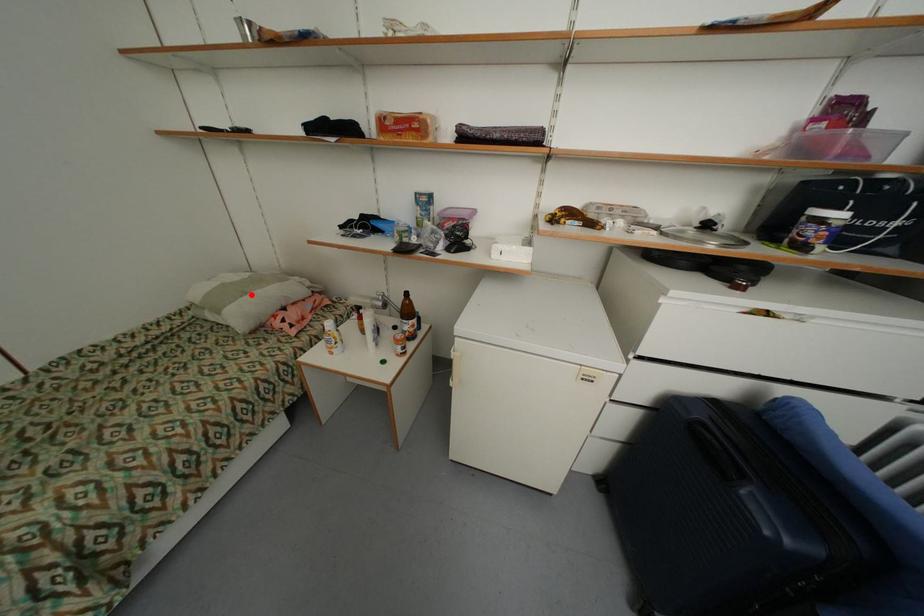
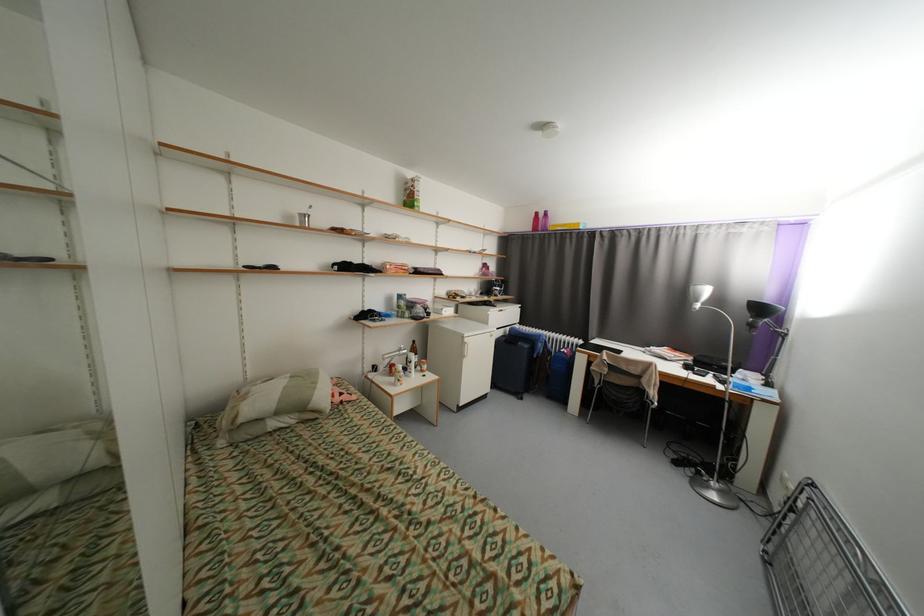
Question: A red point is marked in image1. In image2, is the corresponding 3D point closer to the camera or farther? Reply with the corresponding letter.

Choices:
 (A) The corresponding 3D point is closer.
 (B) The corresponding 3D point is farther.

Answer: (A)